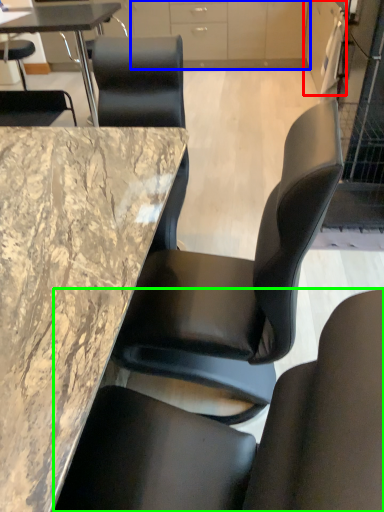
Question: Which is nearer to the cabinetry (highlighted by a red box)? cabinetry (highlighted by a blue box) or chair (highlighted by a green box).

Choices:
 (A) cabinetry
 (B) chair

Answer: (A)